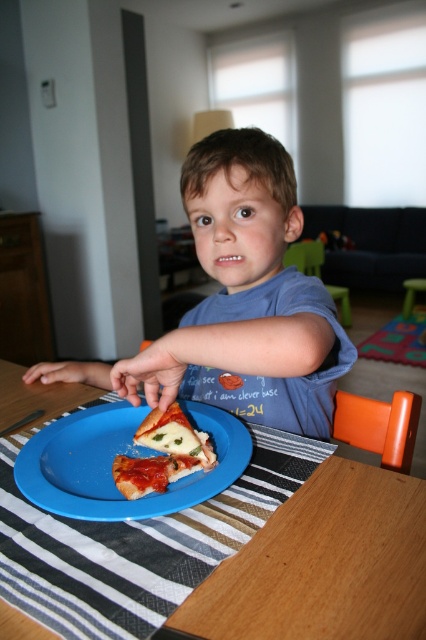
Who is more distant from viewer, (x=80, y=513) or (x=183, y=428)?

Point (x=183, y=428)

Who is higher up, blue plastic plate at center or golden brown crusty pizza at center?

golden brown crusty pizza at center

Between point (230, 460) and point (152, 461), which one is positioned behind?

Positioned behind is point (152, 461).

Where is `blue plastic plate at center`? Image resolution: width=426 pixels, height=640 pixels. blue plastic plate at center is located at coordinates (123, 454).

In the scene shown: Does blue cotton shirt at center have a greater height compared to wooden table at center?

Correct, blue cotton shirt at center is much taller as wooden table at center.

Between point (143, 368) and point (336, 465), which one is positioned behind?

Point (336, 465)

Between point (256, 358) and point (336, 609), which one is positioned behind?

The point (256, 358) is more distant.

Find the location of `blue cotton shirt at center`. blue cotton shirt at center is located at coordinates (239, 301).

Does blue cotton shirt at center have a lesser width compared to blue plastic plate at center?

No, blue cotton shirt at center is not thinner than blue plastic plate at center.

Who is higher up, blue cotton shirt at center or blue plastic plate at center?

blue cotton shirt at center is higher up.

Which is in front, point (316, 298) or point (170, 493)?

Point (170, 493)

Identify the location of blue cotton shirt at center. (239, 301).